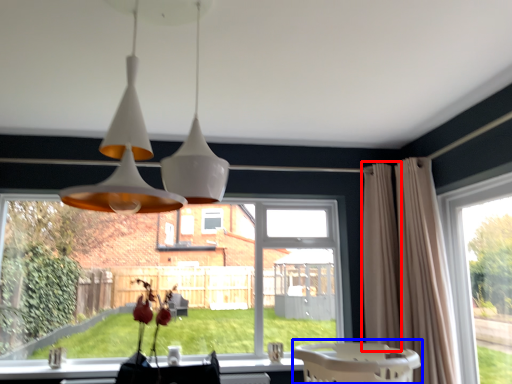
Question: Which object is further to the camera taking this photo, curtain (highlighted by a red box) or baby carriage (highlighted by a blue box)?

Choices:
 (A) curtain
 (B) baby carriage

Answer: (A)